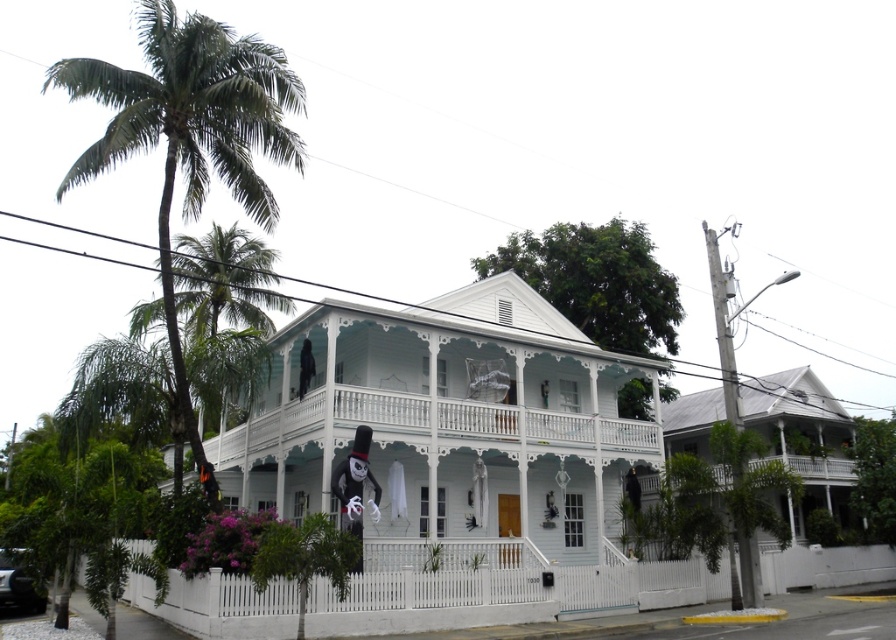
You are planning to park your car next to the white painted wood porch at center. Considering the space available, can you determine if the black glossy car at lower left will fit alongside the porch without overlapping?

The white painted wood porch at center might be wider than black glossy car at lower left, so there is a possibility that the car can fit alongside the porch without overlapping. However, the exact dimensions are uncertain based on the available information.

You are planning to park your car next to the green leafy palm tree at left. Based on the scene, will the black glossy car at lower left fit between the palm tree and the white picket fence without overlapping?

The green leafy palm tree at left is wider than the black glossy car at lower left, so there should be enough space for the car to fit between the palm tree and the white picket fence without overlapping.

You are standing at the entrance of the house and want to take a photo of the green leafy palm tree at left. Which direction should you face to capture it in the frame?

You should face towards the left side of the house to capture the green leafy palm tree at left in your photo.